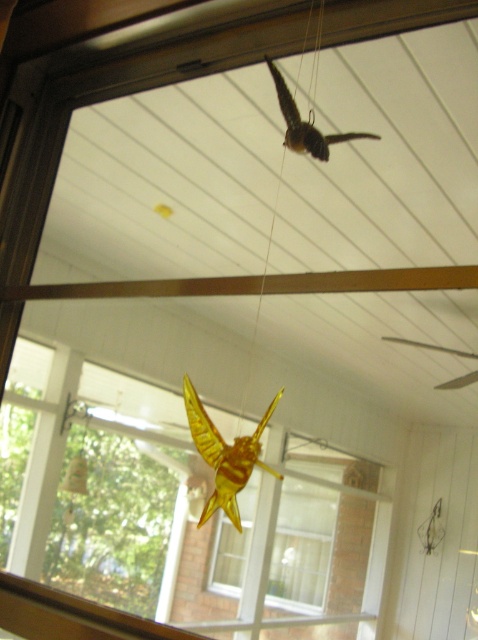
You are an interior designer planning to hang a new decoration in the room. You notice the brown wooden beam at center and the translucent amber insect at center. Which object is larger and could potentially block more light coming through the window?

The translucent amber insect at center is larger than the brown wooden beam at center, so it could potentially block more light coming through the window.

You are a painter standing in the room and want to paint the brown wooden beam at center and the translucent amber insect at center. Which object is shorter in height?

The brown wooden beam at center has a lesser height compared to the translucent amber insect at center, so the brown wooden beam at center is shorter in height.

You are standing in the sunroom and want to hang a new decoration between the brown matte bird at upper center and the translucent yellow insect at upper center. Is there enough vertical space between them to fit a decoration that is 15 cm tall?

The brown matte bird at upper center is located above the translucent yellow insect at upper center, but the exact vertical distance between them is not provided. Without knowing the space, it is impossible to determine if the 15 cm tall decoration will fit.